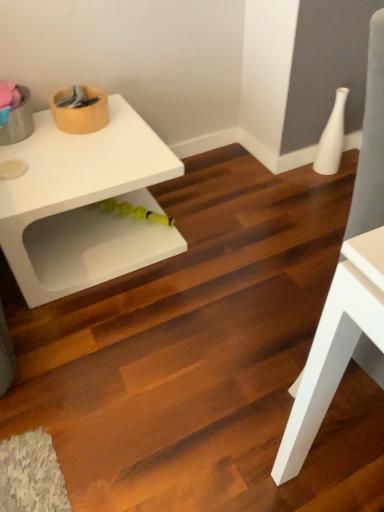
I want to click on free space in front of white glossy vase at upper right, so (x=328, y=188).